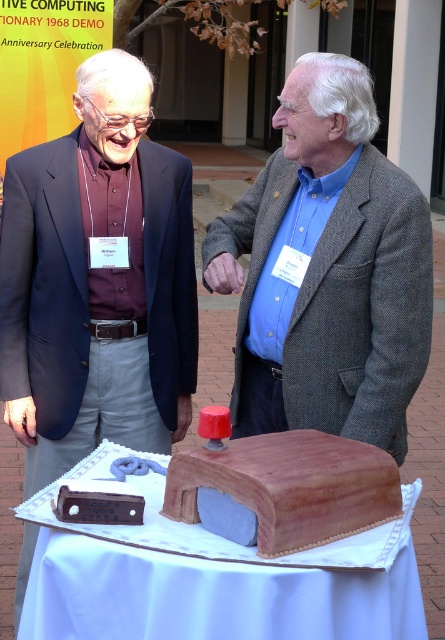
Question: Which is farther from the matte black suit at center?

Choices:
 (A) blue woolen jacket at center
 (B) brown leather book at center
 (C) smooth brown cake at center

Answer: (B)

Question: Which of the following is the farthest from the observer?

Choices:
 (A) brown leather book at center
 (B) blue woolen jacket at center
 (C) smooth brown cake at center

Answer: (B)

Question: Does matte black suit at center come in front of smooth brown cake at center?

Choices:
 (A) no
 (B) yes

Answer: (A)

Question: Is matte black suit at center positioned in front of brown leather book at center?

Choices:
 (A) no
 (B) yes

Answer: (A)

Question: Which point appears farthest from the camera in this image?

Choices:
 (A) (295, 348)
 (B) (182, 490)
 (C) (172, 340)

Answer: (C)

Question: Is smooth brown cake at center to the left of brown leather book at center from the viewer's perspective?

Choices:
 (A) no
 (B) yes

Answer: (B)